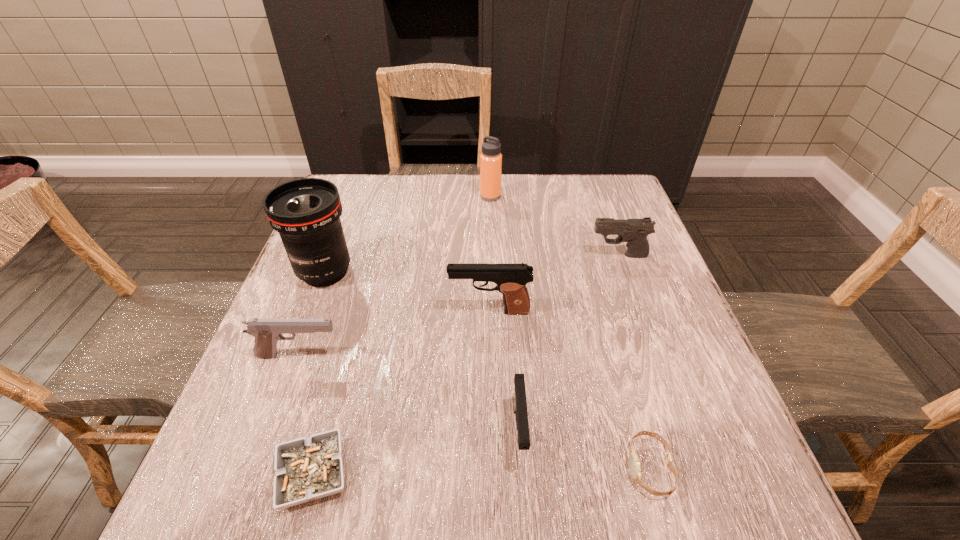
You are a GUI agent. You are given a task and a screenshot of the screen. Output one action in this format:
    pyautogui.click(x=<x>, y=<y>)
    Task: Click on the telephoto lens
    The width and height of the screenshot is (960, 540).
    Given the screenshot: What is the action you would take?
    pyautogui.click(x=306, y=212)

At what (x,y) coordinates should I click in order to perform the action: click on the farthest object. Please return your answer as a coordinate pair (x, y). Looking at the image, I should click on (490, 159).

Image resolution: width=960 pixels, height=540 pixels. Find the location of `thermos bottle`. thermos bottle is located at coordinates (490, 159).

You are a GUI agent. You are given a task and a screenshot of the screen. Output one action in this format:
    pyautogui.click(x=<x>, y=<y>)
    Task: Click on the second farthest pistol
    
    Given the screenshot: What is the action you would take?
    pyautogui.click(x=511, y=279)

Find the location of a particular element. The height and width of the screenshot is (540, 960). the sixth shortest object is located at coordinates (511, 279).

You are a GUI agent. You are given a task and a screenshot of the screen. Output one action in this format:
    pyautogui.click(x=<x>, y=<y>)
    Task: Click on the farthest pistol
    This screenshot has height=540, width=960.
    Given the screenshot: What is the action you would take?
    pyautogui.click(x=633, y=231)

What are the coordinates of `the second nearest pistol` in the screenshot? It's located at (267, 332).

The height and width of the screenshot is (540, 960). I want to click on the leftmost pistol, so click(267, 332).

Locate an element on the screen. The image size is (960, 540). the nearest pistol is located at coordinates coord(519,396).

This screenshot has width=960, height=540. In order to click on the shortest pistol in this screenshot , I will do point(519,396).